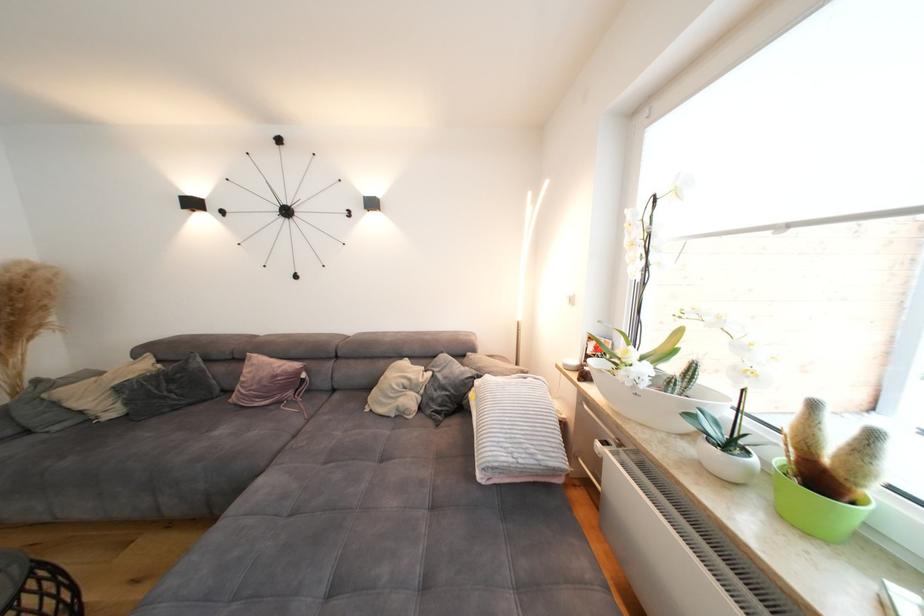
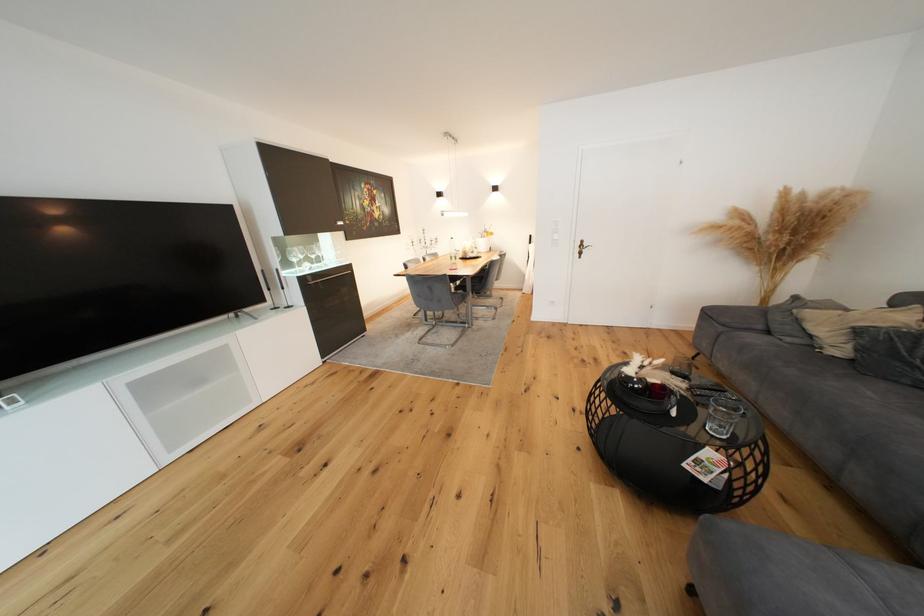
Looking at this image, based on the continuous images, in which direction is the camera rotating?

The camera's rotation is toward left-down.